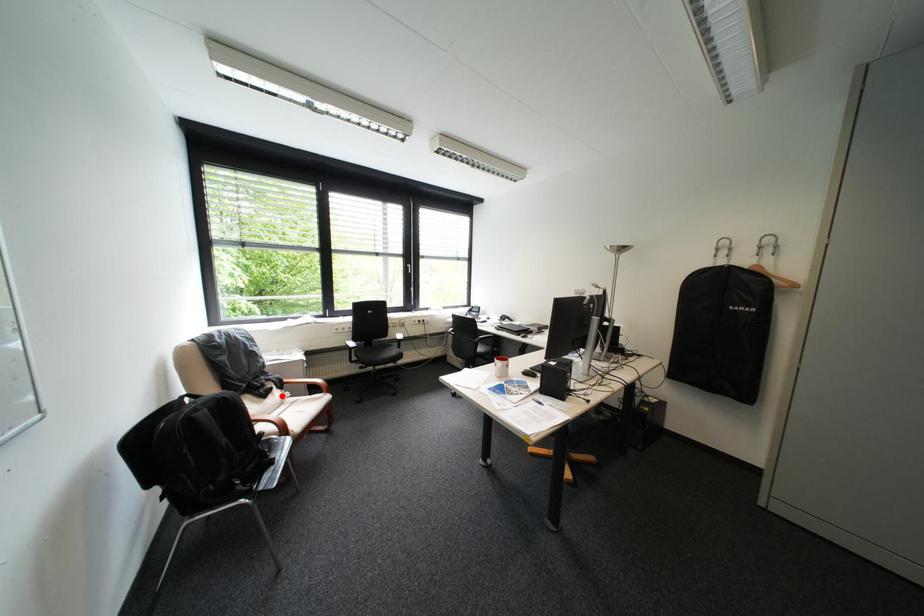
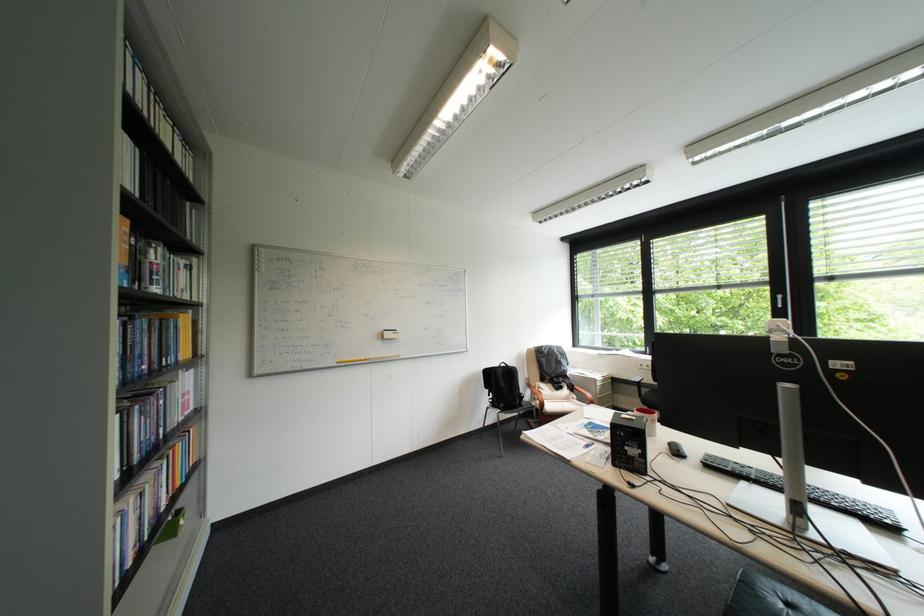
Question: A red point is marked in image1. In image2, is the corresponding 3D point closer to the camera or farther? Reply with the corresponding letter.

Choices:
 (A) The corresponding 3D point is closer.
 (B) The corresponding 3D point is farther.

Answer: (B)